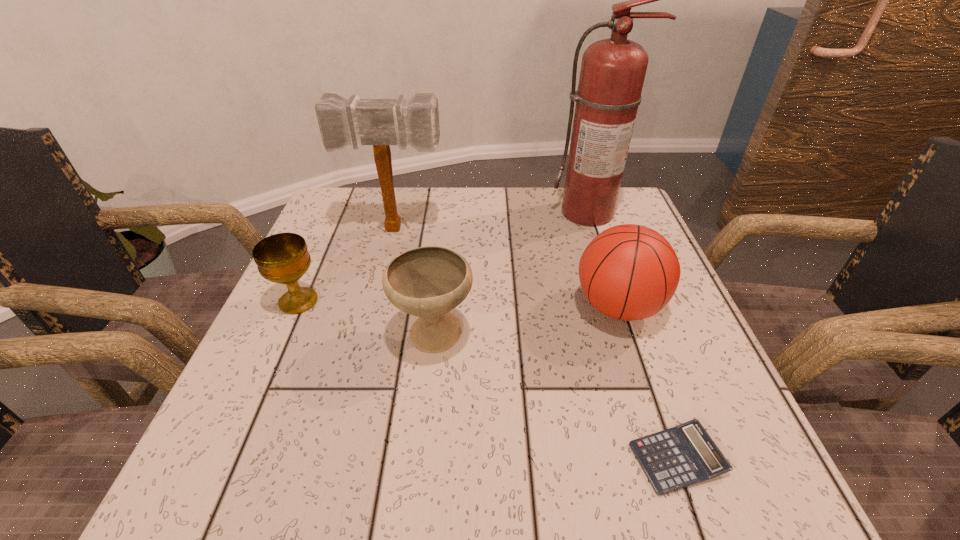
Identify the location of fire extinguisher. The width and height of the screenshot is (960, 540). (612, 74).

At what (x,y) coordinates should I click in order to perform the action: click on mallet. Please return your answer as a coordinate pair (x, y). The height and width of the screenshot is (540, 960). Looking at the image, I should click on (379, 122).

Locate an element on the screen. This screenshot has width=960, height=540. basketball is located at coordinates 628,272.

The height and width of the screenshot is (540, 960). Identify the location of the right chalice. (428, 282).

The image size is (960, 540). Identify the location of the shorter chalice. (283, 258).

The width and height of the screenshot is (960, 540). In order to click on the left chalice in this screenshot , I will do `click(283, 258)`.

What are the coordinates of `the shortest object` in the screenshot? It's located at (684, 455).

What are the coordinates of `the nearest object` in the screenshot? It's located at (684, 455).

Locate an element on the screen. Image resolution: width=960 pixels, height=540 pixels. free region located on the front-facing side of the tallest object is located at coordinates (627, 326).

The width and height of the screenshot is (960, 540). In order to click on vacant area situated 0.300m on the right of the second tallest object in this screenshot , I will do `click(569, 229)`.